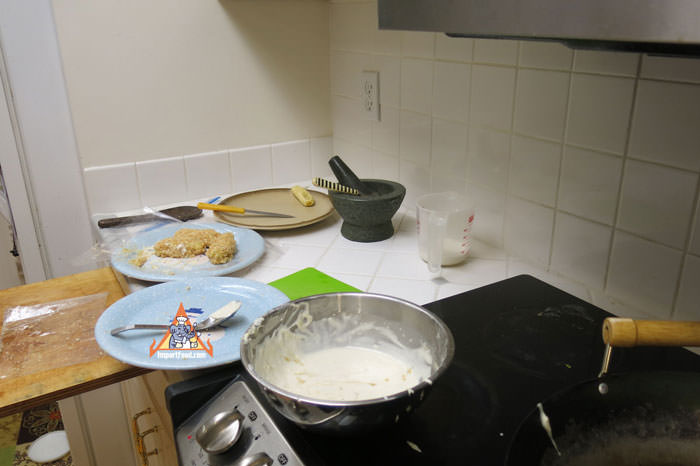
This screenshot has width=700, height=466. Find the location of `plate`. plate is located at coordinates (138, 297).